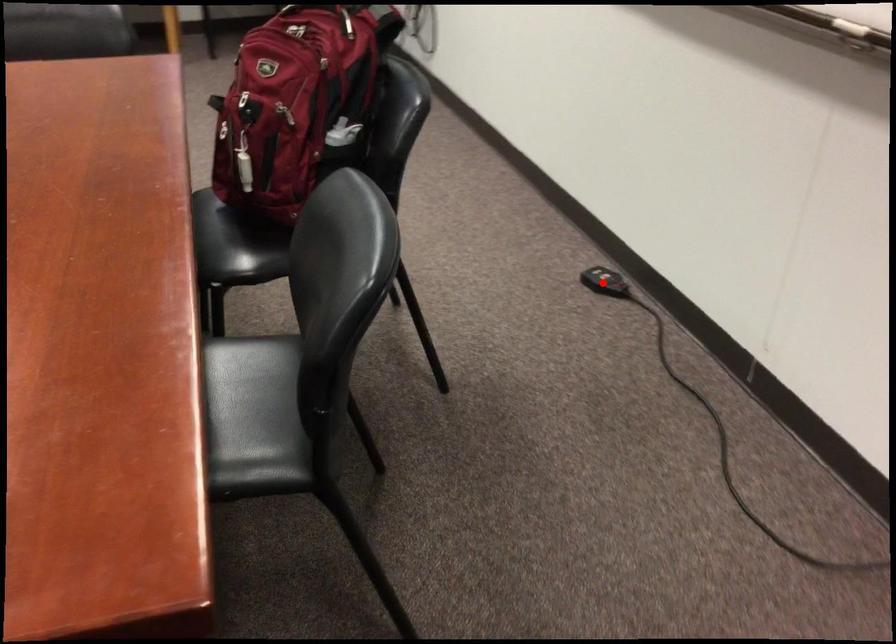
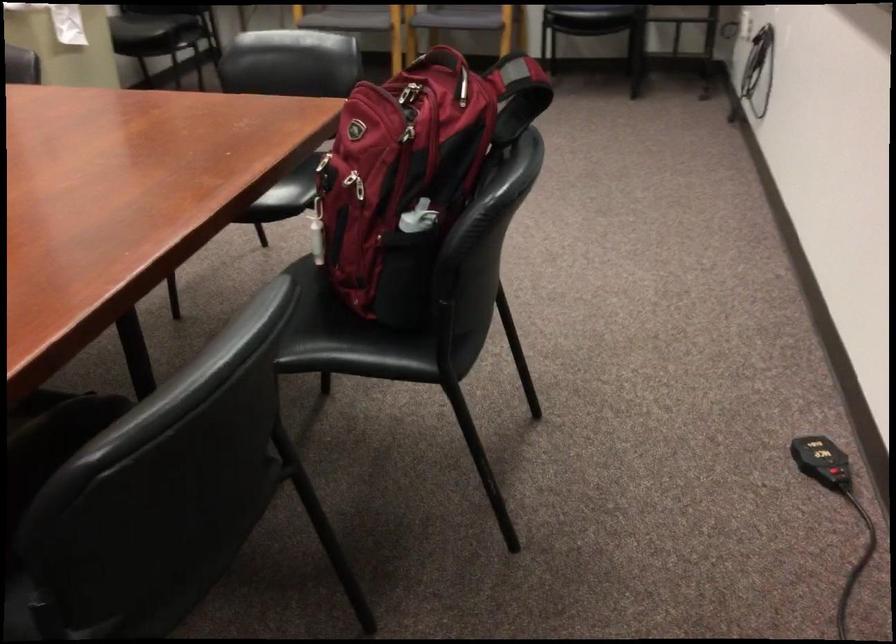
Question: I am providing you with two images of the same scene from different viewpoints. Given a red point in image1, look at the same physical point in image2. Is it:

Choices:
 (A) Closer to the viewpoint
 (B) Farther from the viewpoint

Answer: (A)